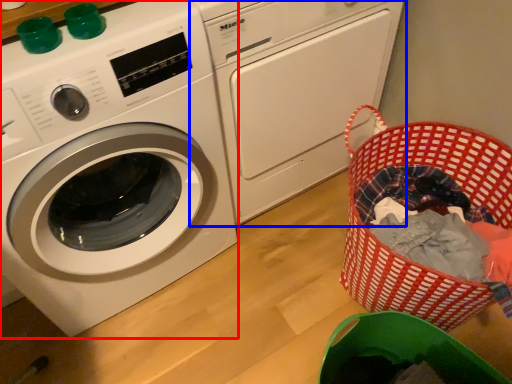
Question: Which object appears farthest to the camera in this image, washing machine (highlighted by a red box) or washing machine (highlighted by a blue box)?

Choices:
 (A) washing machine
 (B) washing machine

Answer: (B)